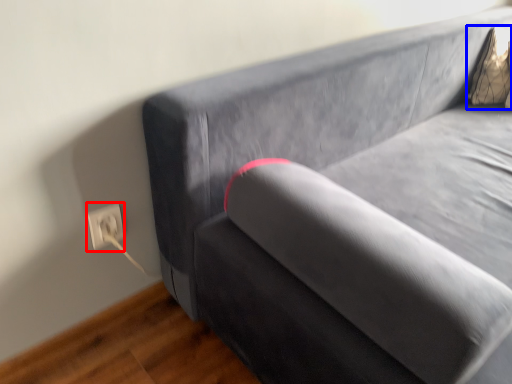
Question: Among these objects, which one is farthest to the camera, electric outlet (highlighted by a red box) or pillow (highlighted by a blue box)?

Choices:
 (A) electric outlet
 (B) pillow

Answer: (B)